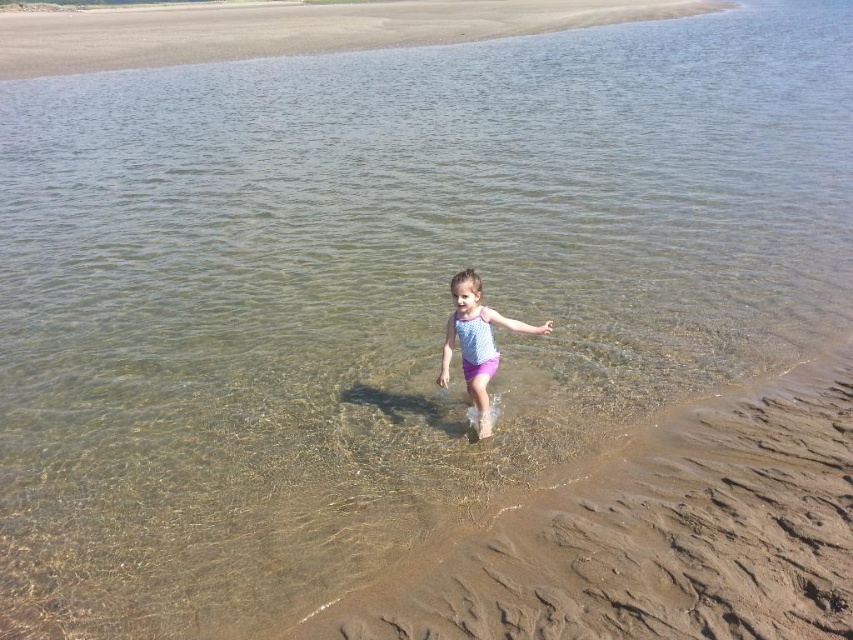
You are standing at the edge of the beach and see the smooth sand at upper center. If you want to walk directly towards it, which direction should you move?

You should move towards the upper center direction to reach the smooth sand at upper center.